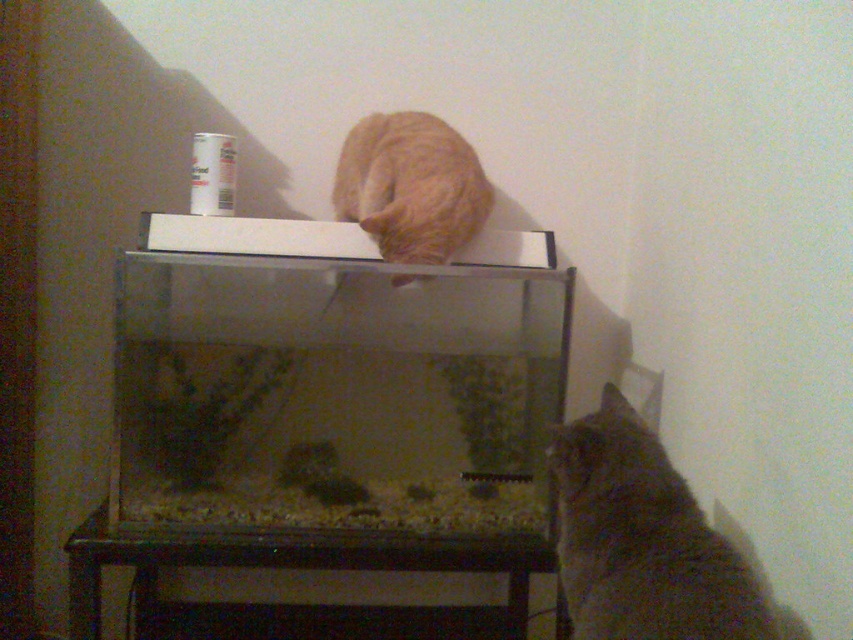
How much distance is there between fuzzy brown cat at lower right and orange fur cat at upper center?

fuzzy brown cat at lower right and orange fur cat at upper center are 23.77 inches apart.

Between fuzzy brown cat at lower right and orange fur cat at upper center, which one is positioned higher?

orange fur cat at upper center

Which is behind, point (697, 593) or point (450, 205)?

The point (450, 205) is more distant.

Locate an element on the screen. Image resolution: width=853 pixels, height=640 pixels. fuzzy brown cat at lower right is located at coordinates (643, 540).